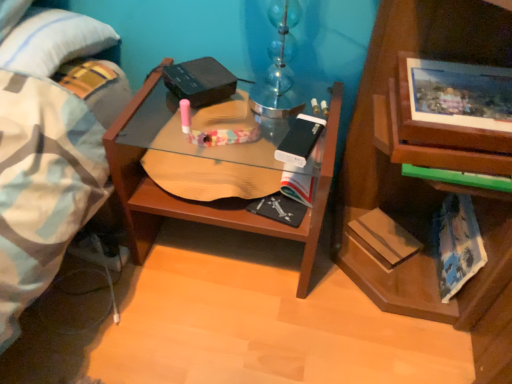
At what (x,y) coordinates should I click in order to perform the action: click on vacant location below wooden desk at center (from a real-world perspective). Please return your answer as a coordinate pair (x, y). Looking at the image, I should click on (231, 248).